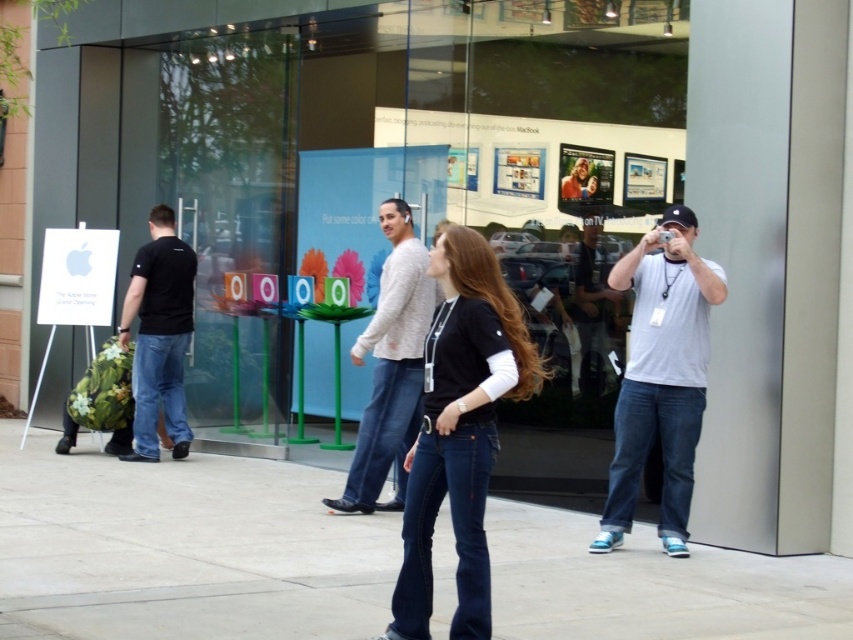
Is smooth concrete pavement at center closer to camera compared to black matte t-shirt at left?

Yes, it is in front of black matte t-shirt at left.

Is point (184, 554) farther from camera compared to point (187, 269)?

That is False.

Is point (279, 625) positioned after point (148, 285)?

That is False.

This screenshot has height=640, width=853. Find the location of `smooth concrete pavement at center`. smooth concrete pavement at center is located at coordinates (183, 548).

Identify the location of light gray sweater at center. (390, 365).

Does light gray sweater at center come in front of black matte t-shirt at left?

Yes, light gray sweater at center is in front of black matte t-shirt at left.

Does point (395, 280) lie behind point (146, 266)?

No, it is not.

The width and height of the screenshot is (853, 640). Find the location of `light gray sweater at center`. light gray sweater at center is located at coordinates (390, 365).

Who is taller, denim jeans at center or white cotton t-shirt at right?

white cotton t-shirt at right is taller.

Is point (462, 522) more distant than point (671, 344)?

No, it is not.

I want to click on denim jeans at center, so click(x=460, y=429).